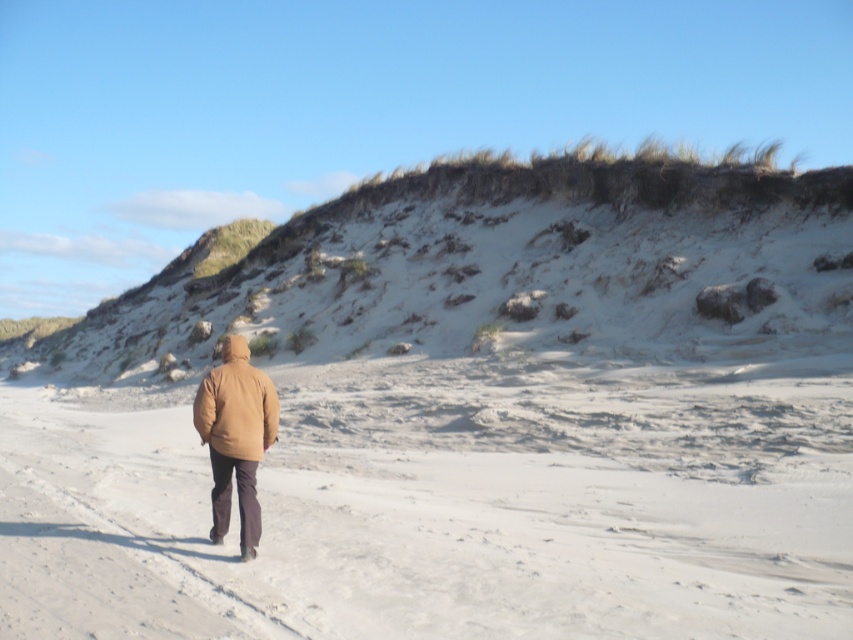
Question: Which object is the closest to the white sandy beach at center?

Choices:
 (A) matte brown jacket at center
 (B) sandy/gravelly hillside at upper center

Answer: (A)

Question: Is sandy/gravelly hillside at upper center below matte brown jacket at center?

Choices:
 (A) yes
 (B) no

Answer: (B)

Question: Which object is closer to the camera taking this photo?

Choices:
 (A) white sandy beach at center
 (B) sandy/gravelly hillside at upper center
 (C) matte brown jacket at center

Answer: (A)

Question: Which of these objects is positioned closest to the sandy/gravelly hillside at upper center?

Choices:
 (A) matte brown jacket at center
 (B) white sandy beach at center

Answer: (B)

Question: Does white sandy beach at center have a larger size compared to sandy/gravelly hillside at upper center?

Choices:
 (A) no
 (B) yes

Answer: (A)

Question: Can you confirm if white sandy beach at center is positioned to the left of matte brown jacket at center?

Choices:
 (A) yes
 (B) no

Answer: (B)